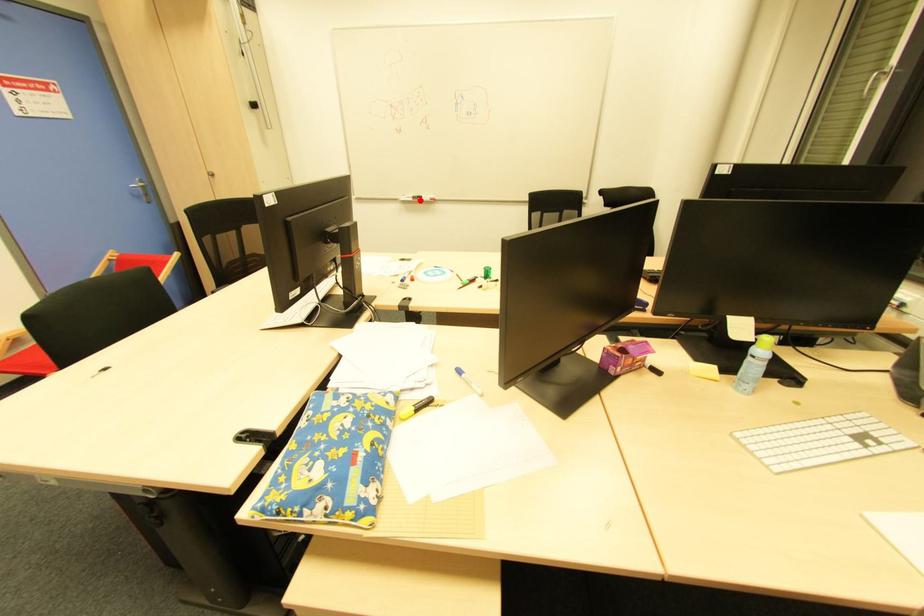
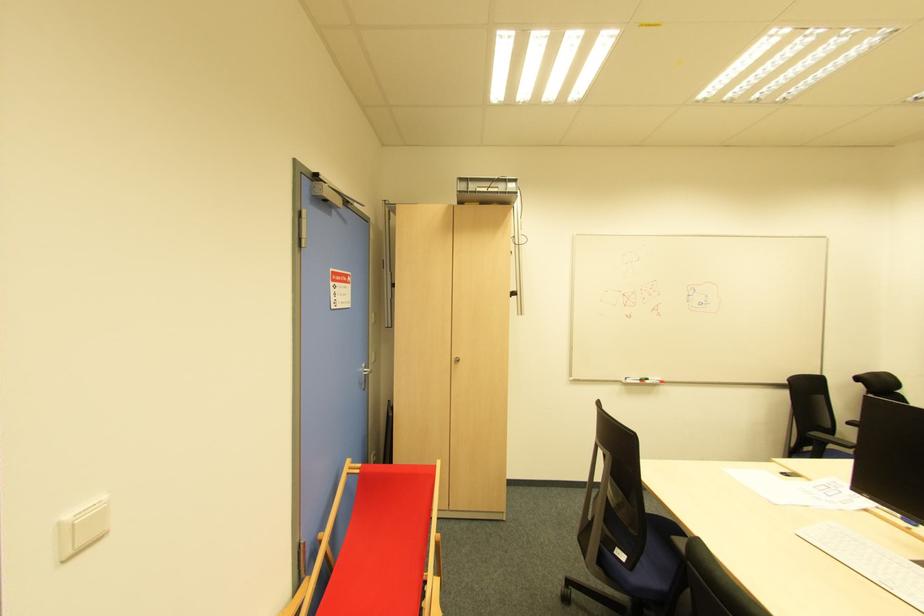
Locate, in the second image, the point that corresponds to the highlighted location in the first image.

(647, 383)